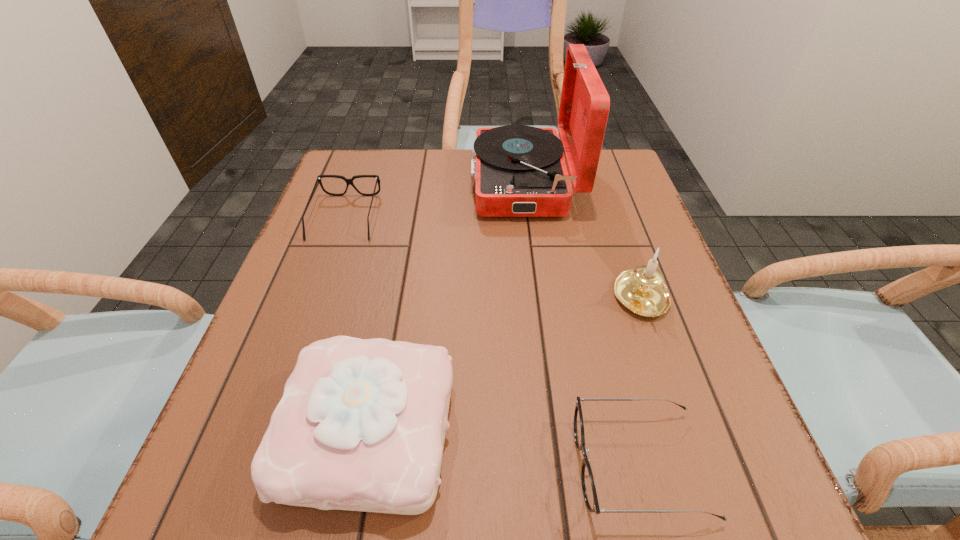
Locate an element on the screen. The height and width of the screenshot is (540, 960). vacant space at the right edge of the desktop is located at coordinates (606, 262).

Where is `free space at the far left corner`? Image resolution: width=960 pixels, height=540 pixels. free space at the far left corner is located at coordinates (379, 155).

The image size is (960, 540). What are the coordinates of `free spot at the near right corner of the desktop` in the screenshot? It's located at (766, 521).

Image resolution: width=960 pixels, height=540 pixels. In order to click on vacant area between the phonograph_record and the third shortest object in this screenshot , I will do `click(446, 306)`.

Locate an element on the screen. The height and width of the screenshot is (540, 960). empty location between the third shortest object and the farther spectacles is located at coordinates (357, 323).

Locate an element on the screen. The image size is (960, 540). free space that is in between the nearer spectacles and the farther spectacles is located at coordinates (492, 341).

Identify the location of blank region between the third nearest object and the right spectacles. (640, 382).

Locate an element on the screen. The width and height of the screenshot is (960, 540). free space that is in between the candle holder and the left spectacles is located at coordinates (493, 259).

The width and height of the screenshot is (960, 540). Find the location of `vacant area that lies between the left spectacles and the third nearest object`. vacant area that lies between the left spectacles and the third nearest object is located at coordinates click(x=493, y=259).

Locate an element on the screen. vacant area that lies between the farther spectacles and the third nearest object is located at coordinates pyautogui.click(x=493, y=259).